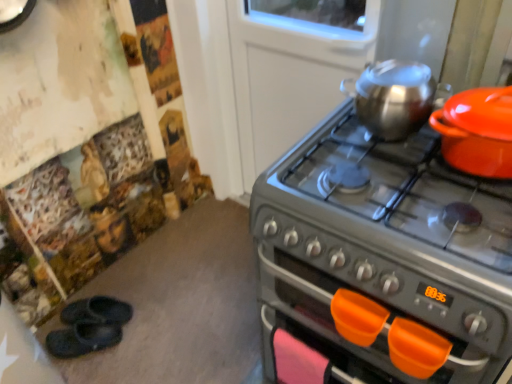
In order to face orange plastic handle at lower center, should I rotate leftwards or rightwards?

To align with it, rotate right about 17.634°.

The width and height of the screenshot is (512, 384). Describe the element at coordinates (97, 310) in the screenshot. I see `black rubber slippers at lower left, which is the 1th footwear from back to front` at that location.

In order to click on shiny metallic kettle at upper right, positioned as the second kitchen appliance in right-to-left order in this screenshot , I will do `click(395, 97)`.

This screenshot has height=384, width=512. What do you see at coordinates (477, 131) in the screenshot?
I see `matte orange pot at right, positioned as the 2th kitchen appliance in left-to-right order` at bounding box center [477, 131].

The width and height of the screenshot is (512, 384). What are the coordinates of `metallic gray gas stove at right` in the screenshot? It's located at (384, 250).

At what (x,y) coordinates should I click in order to perform the action: click on orange plastic handle at lower center. Please return your answer as a coordinate pair (x, y). This screenshot has width=512, height=384. Looking at the image, I should click on (416, 348).

Looking at their sizes, would you say metallic gray gas stove at right is wider or thinner than orange plastic handle at lower center?

metallic gray gas stove at right is wider than orange plastic handle at lower center.

Is orange plastic handle at lower center inside metallic gray gas stove at right?

Yes, metallic gray gas stove at right contains orange plastic handle at lower center.

Between metallic gray gas stove at right and orange plastic handle at lower center, which one appears on the left side from the viewer's perspective?

Positioned to the left is orange plastic handle at lower center.

From a real-world perspective, is matte orange pot at right, positioned as the 2th kitchen appliance in left-to-right order, located higher than shiny metallic kettle at upper right, the 1th kitchen appliance in the left-to-right sequence?

Yes, from a real-world perspective, matte orange pot at right, positioned as the 2th kitchen appliance in left-to-right order, is above shiny metallic kettle at upper right, the 1th kitchen appliance in the left-to-right sequence.

This screenshot has height=384, width=512. In the image, there is a matte orange pot at right, positioned as the 2th kitchen appliance in left-to-right order. Identify the location of kitchen appliance below it (from a real-world perspective). (395, 97).

Looking at this image, from the image's perspective, does matte orange pot at right, positioned as the 2th kitchen appliance in left-to-right order, appear higher than shiny metallic kettle at upper right, the 1th kitchen appliance in the left-to-right sequence?

No, from the image's perspective, matte orange pot at right, positioned as the 2th kitchen appliance in left-to-right order, is not on top of shiny metallic kettle at upper right, the 1th kitchen appliance in the left-to-right sequence.

Is matte orange pot at right, positioned as the 2th kitchen appliance in left-to-right order, positioned beyond the bounds of shiny metallic kettle at upper right, the 1th kitchen appliance in the left-to-right sequence?

Yes.

Which is less distant, (415, 273) or (121, 309)?

Clearly, point (415, 273) is closer to the camera than point (121, 309).

How different are the orientations of metallic gray gas stove at right and black rubber slippers at lower left, the second footwear in the back-to-front sequence, in degrees?

The angular difference between metallic gray gas stove at right and black rubber slippers at lower left, the second footwear in the back-to-front sequence, is 49.2 degrees.

In the image, is metallic gray gas stove at right positioned in front of or behind black rubber slippers at lower left, the second footwear in the back-to-front sequence?

metallic gray gas stove at right is in front of black rubber slippers at lower left, the second footwear in the back-to-front sequence.

Considering the sizes of objects metallic gray gas stove at right and black rubber slippers at lower left, marked as the 1th footwear in a front-to-back arrangement, in the image provided, who is shorter, metallic gray gas stove at right or black rubber slippers at lower left, marked as the 1th footwear in a front-to-back arrangement,?

black rubber slippers at lower left, marked as the 1th footwear in a front-to-back arrangement, is shorter.

Considering the relative positions of shiny metallic kettle at upper right, positioned as the second kitchen appliance in right-to-left order, and matte orange pot at right, positioned as the 2th kitchen appliance in left-to-right order, in the image provided, is shiny metallic kettle at upper right, positioned as the second kitchen appliance in right-to-left order, to the left or to the right of matte orange pot at right, positioned as the 2th kitchen appliance in left-to-right order,?

In the image, shiny metallic kettle at upper right, positioned as the second kitchen appliance in right-to-left order, appears on the left side of matte orange pot at right, positioned as the 2th kitchen appliance in left-to-right order.

How different are the orientations of shiny metallic kettle at upper right, positioned as the second kitchen appliance in right-to-left order, and matte orange pot at right, the 1th kitchen appliance positioned from the right, in degrees?

The angular difference between shiny metallic kettle at upper right, positioned as the second kitchen appliance in right-to-left order, and matte orange pot at right, the 1th kitchen appliance positioned from the right, is 0.000924 degrees.

Is shiny metallic kettle at upper right, positioned as the second kitchen appliance in right-to-left order, with matte orange pot at right, positioned as the 2th kitchen appliance in left-to-right order?

No, shiny metallic kettle at upper right, positioned as the second kitchen appliance in right-to-left order, is not touching matte orange pot at right, positioned as the 2th kitchen appliance in left-to-right order.

Is shiny metallic kettle at upper right, positioned as the second kitchen appliance in right-to-left order, oriented away from metallic gray gas stove at right?

No.

From a real-world perspective, is shiny metallic kettle at upper right, positioned as the second kitchen appliance in right-to-left order, over metallic gray gas stove at right?

Yes, from a real-world perspective, shiny metallic kettle at upper right, positioned as the second kitchen appliance in right-to-left order, is on top of metallic gray gas stove at right.

Where is `gas stove on the right of shiny metallic kettle at upper right, positioned as the second kitchen appliance in right-to-left order`? Image resolution: width=512 pixels, height=384 pixels. gas stove on the right of shiny metallic kettle at upper right, positioned as the second kitchen appliance in right-to-left order is located at coordinates (384, 250).

Which object is closer to the camera, shiny metallic kettle at upper right, the 1th kitchen appliance in the left-to-right sequence, or metallic gray gas stove at right?

Positioned in front is metallic gray gas stove at right.

Which is farther from the camera, (308, 149) or (87, 310)?

The point (87, 310) is behind.

Which is more to the left, metallic gray gas stove at right or black rubber slippers at lower left, which appears as the 2th footwear when viewed from the front?

black rubber slippers at lower left, which appears as the 2th footwear when viewed from the front, is more to the left.

What's the angular difference between metallic gray gas stove at right and black rubber slippers at lower left, which is the 1th footwear from back to front,'s facing directions?

There is a 40.4-degree angle between the facing directions of metallic gray gas stove at right and black rubber slippers at lower left, which is the 1th footwear from back to front.

Is black rubber slippers at lower left, which appears as the 2th footwear when viewed from the front, to the left or to the right of metallic gray gas stove at right in the image?

Based on their positions, black rubber slippers at lower left, which appears as the 2th footwear when viewed from the front, is located to the left of metallic gray gas stove at right.

Is metallic gray gas stove at right at the back of black rubber slippers at lower left, which appears as the 2th footwear when viewed from the front?

That's not correct — black rubber slippers at lower left, which appears as the 2th footwear when viewed from the front, is not looking away from metallic gray gas stove at right.

Does black rubber slippers at lower left, which appears as the 2th footwear when viewed from the front, have a smaller size compared to metallic gray gas stove at right?

Yes.

From the image's perspective, who appears lower, black rubber slippers at lower left, which is the 1th footwear from back to front, or metallic gray gas stove at right?

black rubber slippers at lower left, which is the 1th footwear from back to front.

Find the location of a particular element. The image size is (512, 384). gas stove located in front of the orange plastic handle at lower center is located at coordinates (384, 250).

Find the location of `kitchen appliance below the matte orange pot at right, positioned as the 2th kitchen appliance in left-to-right order (from a real-world perspective)`. kitchen appliance below the matte orange pot at right, positioned as the 2th kitchen appliance in left-to-right order (from a real-world perspective) is located at coordinates click(x=395, y=97).

Which object lies further to the anchor point black rubber slippers at lower left, which is the 1th footwear from back to front, metallic gray gas stove at right or shiny metallic kettle at upper right, the 1th kitchen appliance in the left-to-right sequence?

The object further to black rubber slippers at lower left, which is the 1th footwear from back to front, is shiny metallic kettle at upper right, the 1th kitchen appliance in the left-to-right sequence.

Estimate the real-world distances between objects in this image. Which object is closer to black rubber slippers at lower left, the second footwear in the back-to-front sequence, shiny metallic kettle at upper right, positioned as the second kitchen appliance in right-to-left order, or metallic gray gas stove at right?

metallic gray gas stove at right is positioned closer to the anchor black rubber slippers at lower left, the second footwear in the back-to-front sequence.

Considering their positions, is black rubber slippers at lower left, which appears as the 2th footwear when viewed from the front, positioned closer to metallic gray gas stove at right than orange plastic handle at lower center?

The object closer to metallic gray gas stove at right is orange plastic handle at lower center.

Based on their spatial positions, is black rubber slippers at lower left, the second footwear in the back-to-front sequence, or orange plastic handle at lower center further from matte orange pot at right, positioned as the 2th kitchen appliance in left-to-right order?

The object further to matte orange pot at right, positioned as the 2th kitchen appliance in left-to-right order, is black rubber slippers at lower left, the second footwear in the back-to-front sequence.

Based on their spatial positions, is black rubber slippers at lower left, the second footwear in the back-to-front sequence, or shiny metallic kettle at upper right, positioned as the second kitchen appliance in right-to-left order, further from black rubber slippers at lower left, which is the 1th footwear from back to front?

shiny metallic kettle at upper right, positioned as the second kitchen appliance in right-to-left order.

Based on the photo, estimate the real-world distances between objects in this image. Which object is further from orange plastic handle at lower center, shiny metallic kettle at upper right, the 1th kitchen appliance in the left-to-right sequence, or black rubber slippers at lower left, which is the 1th footwear from back to front?

black rubber slippers at lower left, which is the 1th footwear from back to front.

Looking at this image, estimate the real-world distances between objects in this image. Which object is closer to metallic gray gas stove at right, black rubber slippers at lower left, which appears as the 2th footwear when viewed from the front, or black rubber slippers at lower left, the second footwear in the back-to-front sequence?

black rubber slippers at lower left, the second footwear in the back-to-front sequence, is positioned closer to the anchor metallic gray gas stove at right.

Estimate the real-world distances between objects in this image. Which object is further from shiny metallic kettle at upper right, positioned as the second kitchen appliance in right-to-left order, matte orange pot at right, positioned as the 2th kitchen appliance in left-to-right order, or metallic gray gas stove at right?

Among the two, metallic gray gas stove at right is located further to shiny metallic kettle at upper right, positioned as the second kitchen appliance in right-to-left order.

Where is `kitchen appliance between black rubber slippers at lower left, marked as the 1th footwear in a front-to-back arrangement, and matte orange pot at right, positioned as the 2th kitchen appliance in left-to-right order, from left to right`? kitchen appliance between black rubber slippers at lower left, marked as the 1th footwear in a front-to-back arrangement, and matte orange pot at right, positioned as the 2th kitchen appliance in left-to-right order, from left to right is located at coordinates (395, 97).

Identify the location of footwear located between black rubber slippers at lower left, which is the 1th footwear from back to front, and orange plastic handle at lower center in the left-right direction. The image size is (512, 384). (89, 326).

I want to click on footwear between black rubber slippers at lower left, which is the 1th footwear from back to front, and metallic gray gas stove at right, in the horizontal direction, so click(89, 326).

This screenshot has width=512, height=384. I want to click on footwear located between black rubber slippers at lower left, which is the 1th footwear from back to front, and shiny metallic kettle at upper right, the 1th kitchen appliance in the left-to-right sequence, in the left-right direction, so click(89, 326).